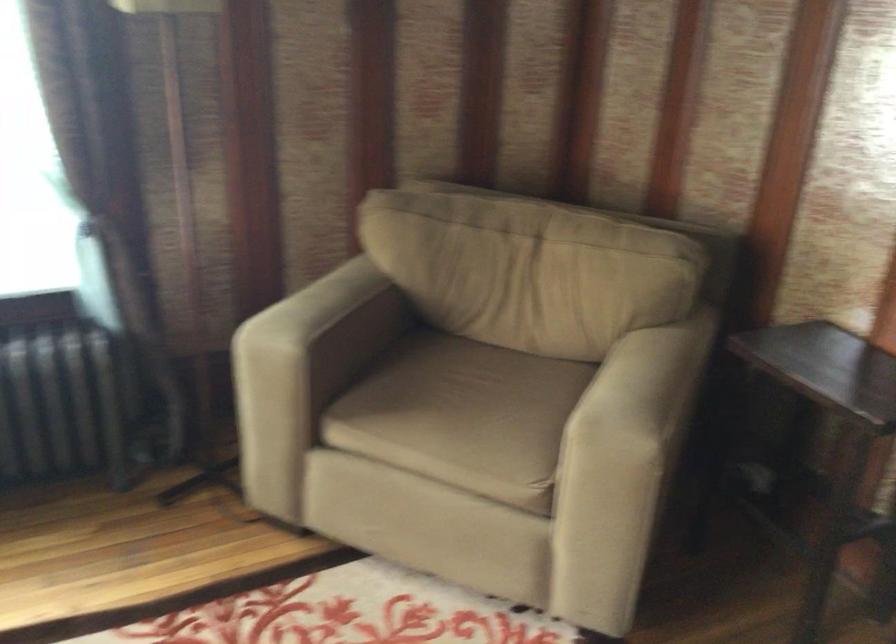
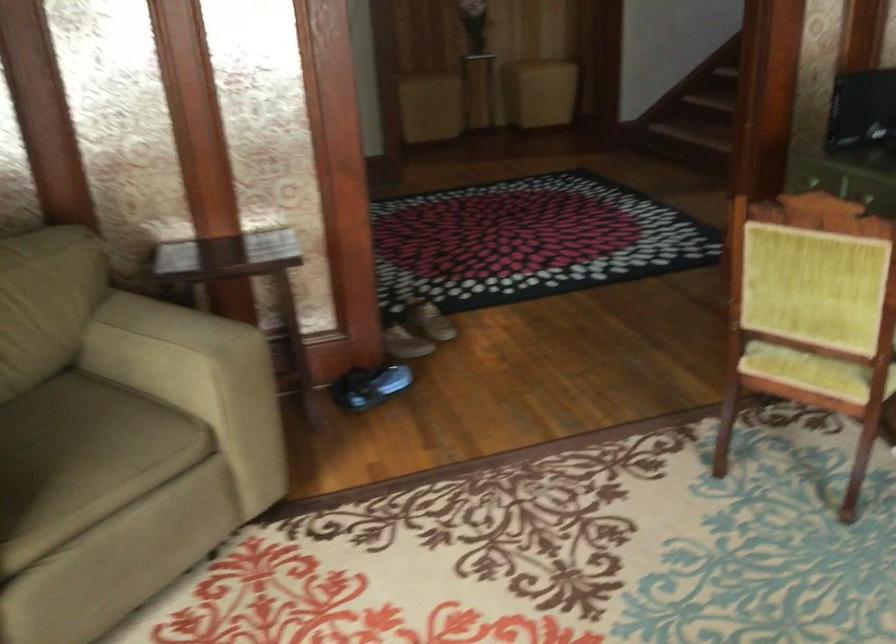
The point at (597, 383) is marked in the first image. Where is the corresponding point in the second image?

(153, 345)